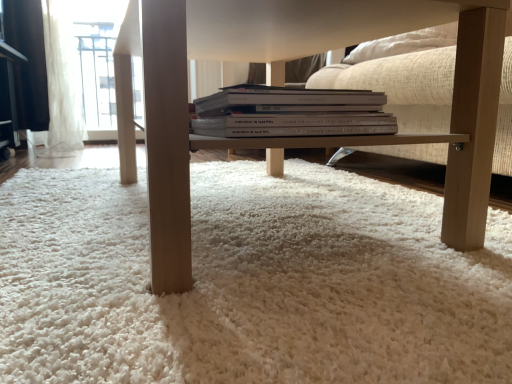
Question: From the image's perspective, is white sheer curtain at upper left positioned above or below light wood table at center?

Choices:
 (A) below
 (B) above

Answer: (B)

Question: Considering the relative positions of white sheer curtain at upper left and light wood table at center in the image provided, is white sheer curtain at upper left to the left or to the right of light wood table at center?

Choices:
 (A) left
 (B) right

Answer: (A)

Question: Estimate the real-world distances between objects in this image. Which object is closer to the white fluffy carpet at center?

Choices:
 (A) white sheer curtain at upper left
 (B) white paper book at center
 (C) light wood table at center

Answer: (C)

Question: Estimate the real-world distances between objects in this image. Which object is farther from the white sheer curtain at upper left?

Choices:
 (A) white paper book at center
 (B) light wood table at center
 (C) white fluffy carpet at center

Answer: (A)